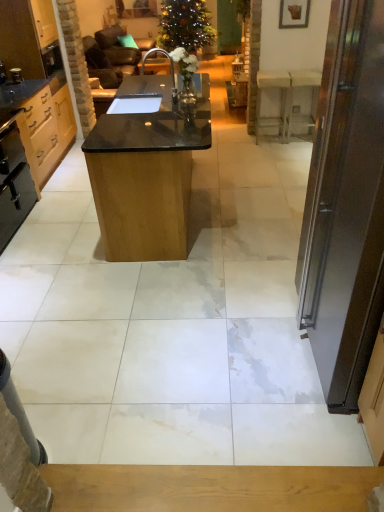
Question: From the image's perspective, is light wood cabinet at left, which is the 2th cabinetry from bottom to top, under white marble table at right, the 1th table from the right?

Choices:
 (A) no
 (B) yes

Answer: (A)

Question: Is the surface of light wood cabinet at left, which is the first cabinetry from top to bottom, in direct contact with white marble table at right, which is the 2th table in front-to-back order?

Choices:
 (A) yes
 (B) no

Answer: (B)

Question: Is the depth of light wood cabinet at left, which is the 2th cabinetry from bottom to top, less than that of white marble table at right, which ranks as the 2th table in left-to-right order?

Choices:
 (A) no
 (B) yes

Answer: (B)

Question: Is light wood cabinet at left, which is the first cabinetry from top to bottom, looking in the opposite direction of white marble table at right, the 1th table from the right?

Choices:
 (A) no
 (B) yes

Answer: (A)

Question: Are light wood cabinet at left, which is the first cabinetry from top to bottom, and white marble table at right, which is the 2th table in front-to-back order, located far from each other?

Choices:
 (A) no
 (B) yes

Answer: (B)

Question: In the image, is white marble table at right, the 1th table from the right, positioned in front of or behind light wood cabinet at left, which is the first cabinetry from top to bottom?

Choices:
 (A) front
 (B) behind

Answer: (B)

Question: From the image's perspective, is white marble table at right, which ranks as the 1th table in back-to-front order, positioned above or below light wood cabinet at left, which is the first cabinetry from top to bottom?

Choices:
 (A) above
 (B) below

Answer: (B)

Question: Based on their positions, is white marble table at right, the 1th table from the right, located to the left or right of light wood cabinet at left, which is the 2th cabinetry from bottom to top?

Choices:
 (A) right
 (B) left

Answer: (A)

Question: Is point (258, 131) positioned closer to the camera than point (41, 110)?

Choices:
 (A) closer
 (B) farther

Answer: (B)

Question: In terms of size, does black granite sink at center appear bigger or smaller than metallic knob at left, the first appliance from the top?

Choices:
 (A) big
 (B) small

Answer: (A)

Question: Is black granite sink at center inside the boundaries of metallic knob at left, positioned as the 2th appliance in bottom-to-top order, or outside?

Choices:
 (A) outside
 (B) inside

Answer: (A)

Question: In the image, is black granite sink at center positioned in front of or behind metallic knob at left, the first appliance from the top?

Choices:
 (A) behind
 (B) front

Answer: (B)

Question: Considering the relative positions of black granite sink at center and metallic knob at left, which ranks as the first appliance in back-to-front order, in the image provided, is black granite sink at center to the left or to the right of metallic knob at left, which ranks as the first appliance in back-to-front order,?

Choices:
 (A) left
 (B) right

Answer: (B)

Question: Is point (359, 130) positioned closer to the camera than point (208, 31)?

Choices:
 (A) closer
 (B) farther

Answer: (A)

Question: Relative to green matte christmas tree at upper center, is dark brown wooden door at right in front or behind?

Choices:
 (A) front
 (B) behind

Answer: (A)